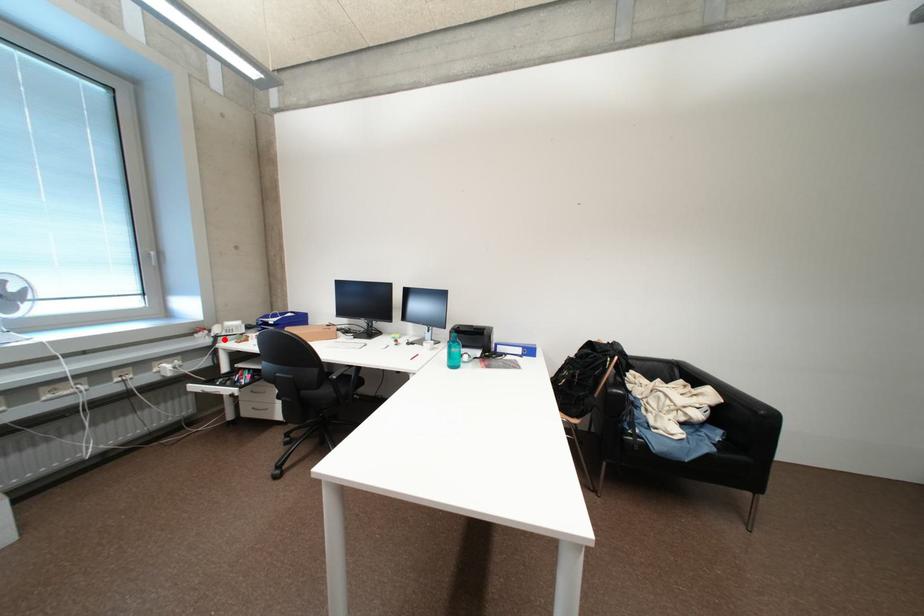
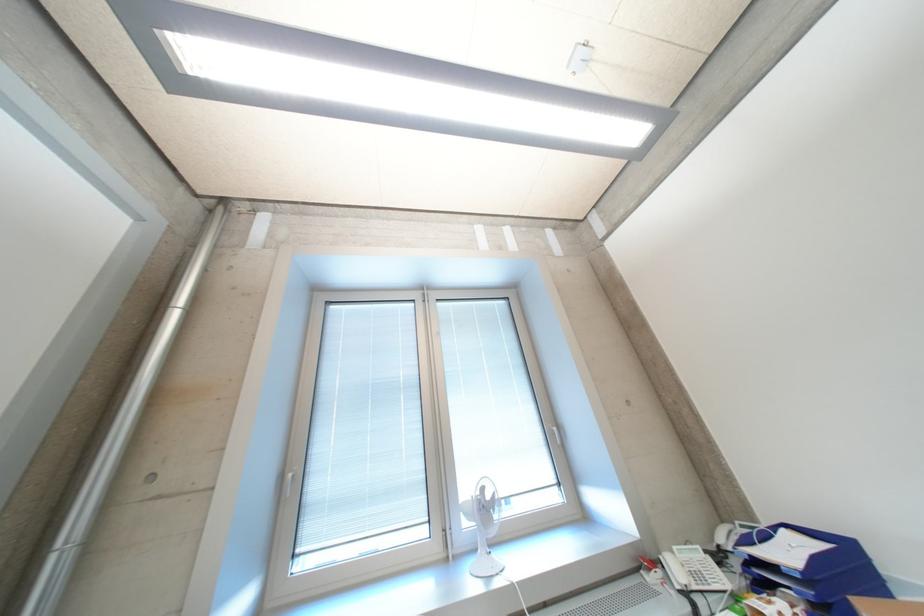
Find the pixel in the second image that matches the highlighted location in the first image.

(696, 597)